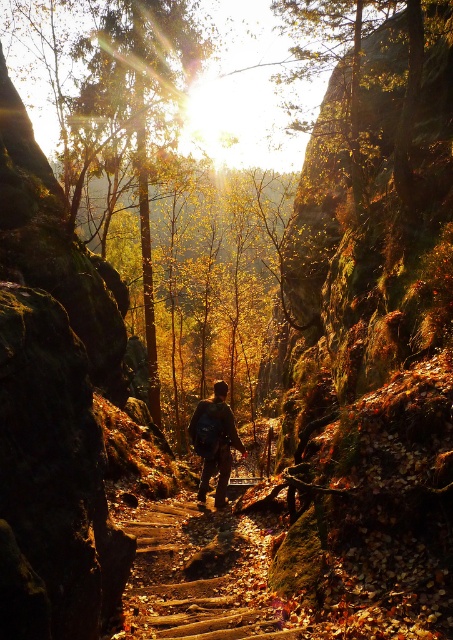
Question: Can you confirm if green mossy rock at center is smaller than brown wooden trail at center?

Choices:
 (A) yes
 (B) no

Answer: (B)

Question: Which point is closer to the camera taking this photo?

Choices:
 (A) (428, 541)
 (B) (170, 582)
 (C) (205, 452)

Answer: (A)

Question: Which point appears closest to the camera in this image?

Choices:
 (A) (191, 564)
 (B) (424, 547)

Answer: (B)

Question: Which point is farther from the camera taking this photo?

Choices:
 (A) (331, 250)
 (B) (212, 436)

Answer: (A)

Question: Does brown wooden trail at center appear on the left side of camouflage backpack at center?

Choices:
 (A) yes
 (B) no

Answer: (A)

Question: Does green mossy rock at center appear on the right side of camouflage backpack at center?

Choices:
 (A) yes
 (B) no

Answer: (A)